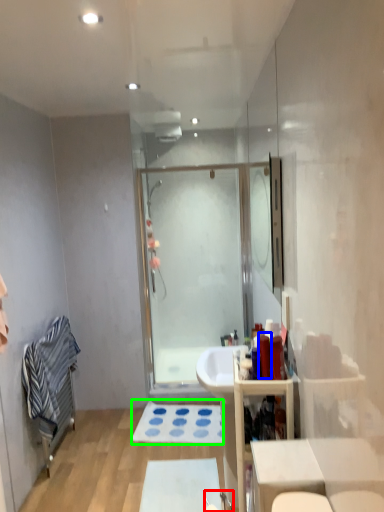
Question: Considering the real-world distances, which object is closest to faucet (highlighted by a red box)? toiletry (highlighted by a blue box) or bath mat (highlighted by a green box).

Choices:
 (A) toiletry
 (B) bath mat

Answer: (B)